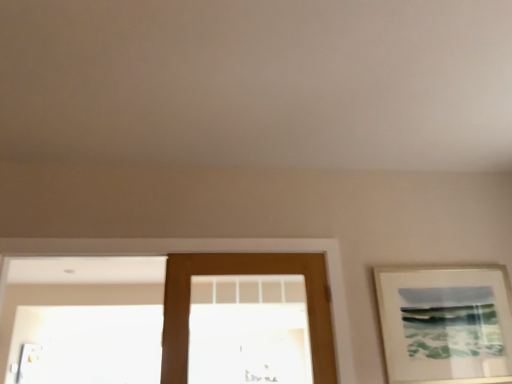
In order to face brown wooden door at center, should I rotate leftwards or rightwards?

It's best to rotate left around 12.009 degrees.

This screenshot has height=384, width=512. Identify the location of brown wooden door at center. (243, 273).

From the image's perspective, would you say brown wooden door at center is shown under brown wooden door at center?

Yes, from the image's perspective, brown wooden door at center is beneath brown wooden door at center.

In the scene shown: From a real-world perspective, is brown wooden door at center on brown wooden door at center?

No.

Does point (213, 260) come behind point (73, 255)?

Yes.

Between brown wooden door at center and brown wooden door at center, which one has more height?

Standing taller between the two is brown wooden door at center.

Is brown wooden door at center oriented towards matte white picture frame at right?

No, brown wooden door at center is not oriented towards matte white picture frame at right.

Would you consider brown wooden door at center to be distant from matte white picture frame at right?

No.

From their relative heights in the image, would you say brown wooden door at center is taller or shorter than matte white picture frame at right?

brown wooden door at center is taller than matte white picture frame at right.

In the image, is brown wooden door at center positioned in front of or behind matte white picture frame at right?

In the image, brown wooden door at center appears in front of matte white picture frame at right.

From the picture: Considering the sizes of objects brown wooden door at center and matte white picture frame at right in the image provided, who is bigger, brown wooden door at center or matte white picture frame at right?

Bigger between the two is brown wooden door at center.

Find the location of `window frame in front of the matte white picture frame at right`. window frame in front of the matte white picture frame at right is located at coordinates (204, 252).

From a real-world perspective, which object stands above the other?

brown wooden door at center, from a real-world perspective.

From the image's perspective, is brown wooden door at center under brown wooden door at center?

Actually, brown wooden door at center appears above brown wooden door at center in the image.

Can you tell me how much brown wooden door at center and brown wooden door at center differ in facing direction?

The angular difference between brown wooden door at center and brown wooden door at center is 0.288 degrees.

Considering the points (331, 316) and (170, 315), which point is in front, point (331, 316) or point (170, 315)?

The point (170, 315) is closer to the camera.

Could you tell me if matte white picture frame at right is facing brown wooden door at center?

No, matte white picture frame at right is not aimed at brown wooden door at center.

What are the coordinates of `picture frame located behind the brown wooden door at center` in the screenshot? It's located at (445, 323).

In the image, is matte white picture frame at right on the left side or the right side of brown wooden door at center?

From the image, it's evident that matte white picture frame at right is to the right of brown wooden door at center.

Which of these two, matte white picture frame at right or brown wooden door at center, is wider?

Wider between the two is brown wooden door at center.

Is brown wooden door at center a part of matte white picture frame at right?

No, matte white picture frame at right does not contain brown wooden door at center.

Based on the photo, between matte white picture frame at right and brown wooden door at center, which one has larger width?

Wider between the two is brown wooden door at center.

Between matte white picture frame at right and brown wooden door at center, which one appears on the right side from the viewer's perspective?

Positioned to the right is matte white picture frame at right.

Considering the positions of objects matte white picture frame at right and brown wooden door at center in the image provided, who is behind, matte white picture frame at right or brown wooden door at center?

matte white picture frame at right.

Where is `door on the right of brown wooden door at center`? The height and width of the screenshot is (384, 512). door on the right of brown wooden door at center is located at coordinates click(x=243, y=273).

Find the location of `picture frame below the brown wooden door at center (from a real-world perspective)`. picture frame below the brown wooden door at center (from a real-world perspective) is located at coordinates (445, 323).

Considering their positions, is brown wooden door at center positioned closer to matte white picture frame at right than brown wooden door at center?

brown wooden door at center is positioned closer to the anchor matte white picture frame at right.

Considering their positions, is matte white picture frame at right positioned closer to brown wooden door at center than brown wooden door at center?

The object closer to brown wooden door at center is brown wooden door at center.

Considering their positions, is brown wooden door at center positioned further to matte white picture frame at right than brown wooden door at center?

brown wooden door at center lies further to matte white picture frame at right than the other object.

When comparing their distances from brown wooden door at center, does brown wooden door at center or matte white picture frame at right seem further?

Based on the image, matte white picture frame at right appears to be further to brown wooden door at center.

Which object lies nearer to the anchor point brown wooden door at center, brown wooden door at center or matte white picture frame at right?

brown wooden door at center is closer to brown wooden door at center.

Based on their spatial positions, is matte white picture frame at right or brown wooden door at center closer to brown wooden door at center?

brown wooden door at center is positioned closer to the anchor brown wooden door at center.

I want to click on door between brown wooden door at center and matte white picture frame at right in the horizontal direction, so [x=243, y=273].